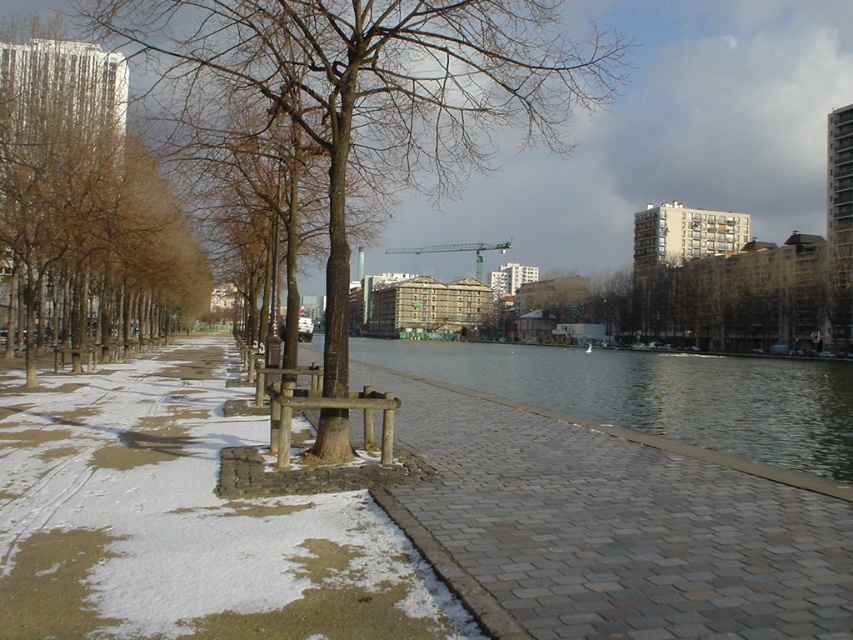
You are a city planner assessing the walkway for accessibility. The wooden bench at center needs to be replaced with a wider one. Considering the brown wood tree at center is in the same area, will the tree interfere with installing a bench that is 1.5 meters wide?

The brown wood tree at center is wider than the wooden bench at center. Since the new bench is 1.5 meters wide and the existing tree is already wider than the current bench, there might not be enough space to install the wider bench without encroaching on the tree.

You are a city planner assessing the riverside walkway. You need to install a bench between the brown smooth tree at left and the brown textured tree at center. Which tree should the bench be closer to if it must be placed closer to the narrower tree?

The bench should be placed closer to the brown smooth tree at left because its width is narrower than the brown textured tree at center.